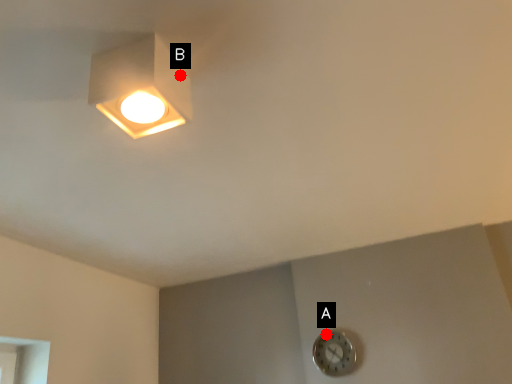
Question: Two points are circled on the image, labeled by A and B beside each circle. Which of the following is the closest to the observer?

Choices:
 (A) A is closer
 (B) B is closer

Answer: (B)